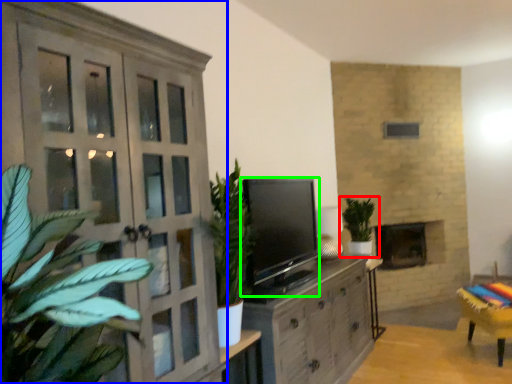
Question: Which is farther away from houseplant (highlighted by a red box)? cupboard (highlighted by a blue box) or level (highlighted by a green box)?

Choices:
 (A) cupboard
 (B) level

Answer: (A)